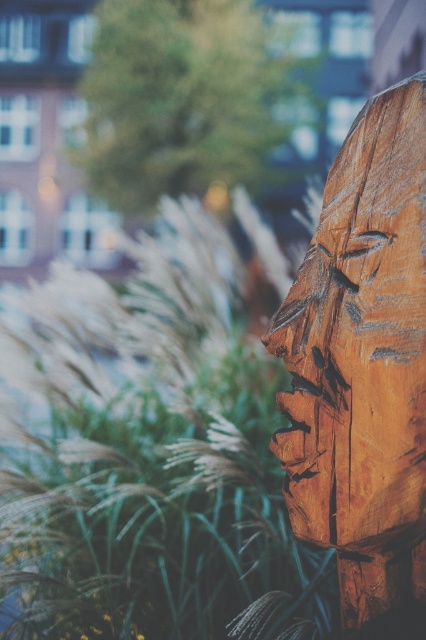
You are an artist who wants to paint the scene. You notice the green grass at left and the natural wood carving at right. Which object is positioned lower in the image?

The green grass at left is located below the natural wood carving at right, so the green grass at left is positioned lower in the image.

Based on the photo, you are a gardener who needs to place a 24 inch wide decorative stone between the green grass at left and the natural wood carving at right. Based on the scene, will the stone fit between them?

The distance between the green grass at left and the natural wood carving at right is 23.38 inches. Since the decorative stone is 24 inches wide, it will not fit between them as the space is slightly narrower than the stone.

Consider the image. You are standing in a garden and see the green grass at left and the natural wood carving at right. Which object is located to the left of the other?

The green grass at left is positioned on the left side of natural wood carving at right.